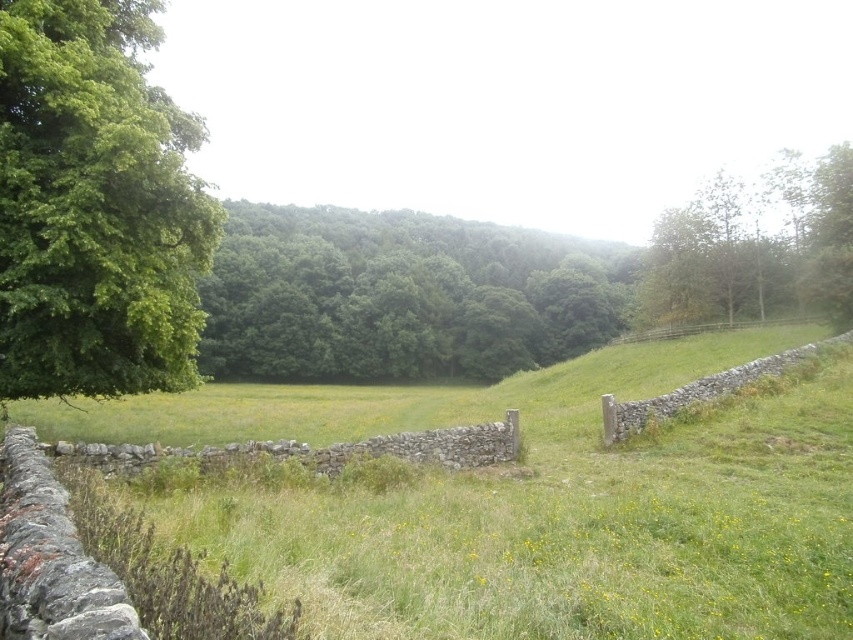
Question: Which point is closer to the camera?

Choices:
 (A) (335, 212)
 (B) (711, 234)
 (C) (654, 328)

Answer: (B)

Question: Can you confirm if dry stone wall at center is positioned to the left of brown wooden fence at right?

Choices:
 (A) yes
 (B) no

Answer: (A)

Question: Which of the following is the farthest from the observer?

Choices:
 (A) brown wooden fence at right
 (B) green leafy trees at center
 (C) dry stone wall at center
 (D) green leafy tree at upper right

Answer: (B)

Question: Is green leafy tree at left wider than green leafy trees at center?

Choices:
 (A) no
 (B) yes

Answer: (A)

Question: Which point is closer to the camera?

Choices:
 (A) (289, 378)
 (B) (714, 259)
 (C) (91, 296)
 (D) (778, 321)

Answer: (C)

Question: Considering the relative positions of green leafy tree at left and green leafy tree at upper right in the image provided, where is green leafy tree at left located with respect to green leafy tree at upper right?

Choices:
 (A) right
 (B) left

Answer: (B)